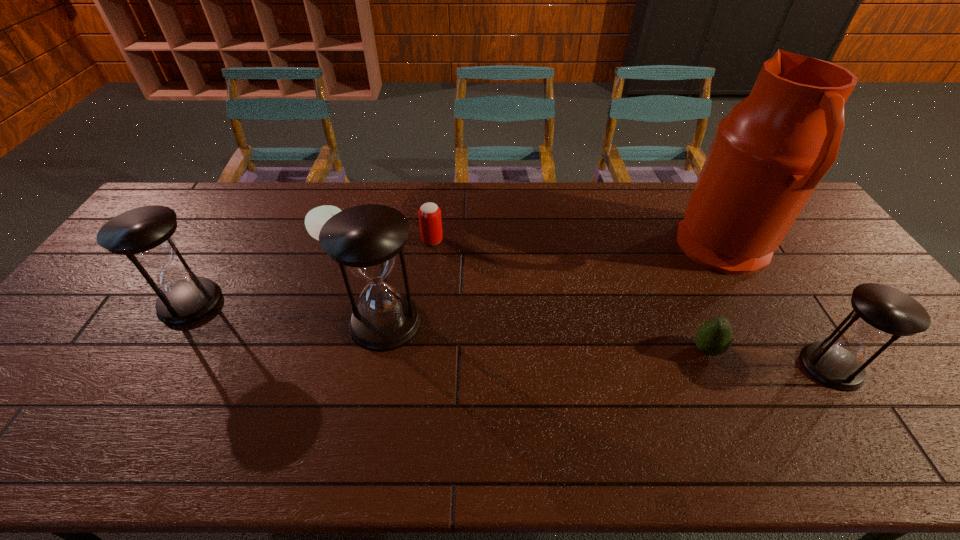
This screenshot has height=540, width=960. In order to click on free space between the apple and the water jug in this screenshot , I will do `click(527, 244)`.

I want to click on vacant region between the beer can and the shortest hourglass, so click(x=632, y=303).

Locate which object is the fourth closest to the tallest object. Please provide its 2D coordinates. Your answer should be formatted as a tuple, i.e. [(x, y)], where the tuple contains the x and y coordinates of a point satisfying the conditions above.

[(366, 238)]

Locate which object ranks fifth in proximity to the apple. Please provide its 2D coordinates. Your answer should be formatted as a tuple, i.e. [(x, y)], where the tuple contains the x and y coordinates of a point satisfying the conditions above.

[(770, 152)]

Choose which hourglass is the third nearest neighbor to the water jug. Please provide its 2D coordinates. Your answer should be formatted as a tuple, i.e. [(x, y)], where the tuple contains the x and y coordinates of a point satisfying the conditions above.

[(144, 234)]

Locate an element on the screen. This screenshot has width=960, height=540. the second closest hourglass to the shortest hourglass is located at coordinates (144, 234).

The height and width of the screenshot is (540, 960). What are the coordinates of `free space that satisfies the following two spatial constraints: 1. on the back side of the rightmost hourglass; 2. from the spout of the water jug` in the screenshot? It's located at pos(756,249).

Locate an element on the screen. The image size is (960, 540). vacant space that satisfies the following two spatial constraints: 1. from the spout of the fourth shortest object; 2. on the left side of the water jug is located at coordinates (791, 367).

What are the coordinates of `free point that satisfies the following two spatial constraints: 1. from the spout of the fourth shortest object; 2. on the left side of the water jug` in the screenshot? It's located at (791, 367).

Find the location of a particular element. free point that satisfies the following two spatial constraints: 1. on the front side of the beer can; 2. on the right side of the second object from left to right is located at coordinates (329, 240).